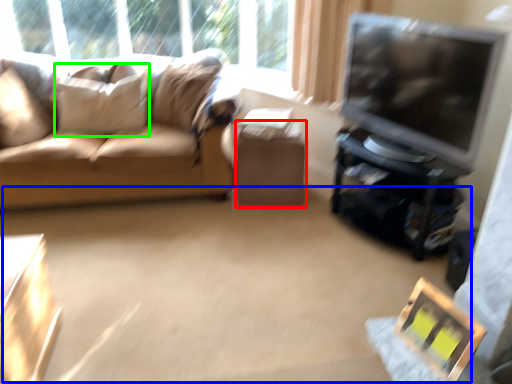
Question: Which is farther away from table (highlighted by a red box)? plain (highlighted by a blue box) or pillow (highlighted by a green box)?

Choices:
 (A) plain
 (B) pillow

Answer: (B)